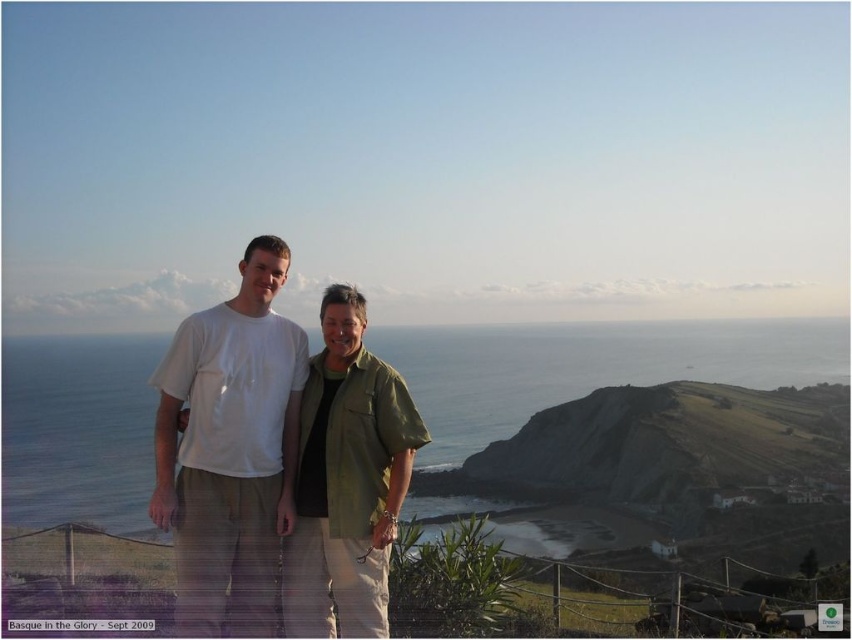
Is blue water at center wider than green fabric shirt at center?

Correct, the width of blue water at center exceeds that of green fabric shirt at center.

This screenshot has width=852, height=640. Describe the element at coordinates (588, 368) in the screenshot. I see `blue water at center` at that location.

The image size is (852, 640). Find the location of `blue water at center`. blue water at center is located at coordinates (588, 368).

Is point (281, 396) less distant than point (378, 529)?

No, it is not.

Which is above, white cotton shirt at center or green fabric shirt at center?

Positioned higher is white cotton shirt at center.

Is point (285, 372) closer to camera compared to point (347, 426)?

No.

Find the location of a particular element. This screenshot has width=852, height=640. white cotton shirt at center is located at coordinates (231, 449).

Who is lower down, blue water at center or white cotton shirt at center?

Positioned lower is blue water at center.

Is point (101, 346) closer to viewer compared to point (248, 481)?

No, (101, 346) is further to viewer.

Find the location of `blue water at center`. blue water at center is located at coordinates (588, 368).